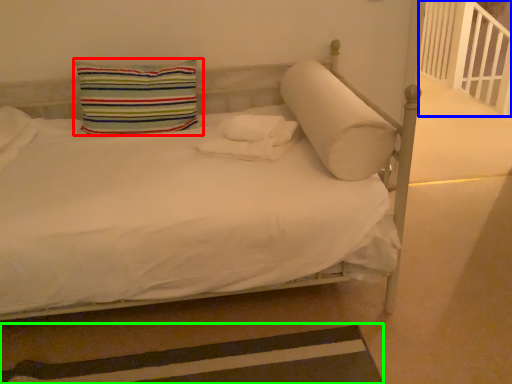
Question: Based on their relative distances, which object is nearer to pillow (highlighted by a red box)? Choose from balustrade (highlighted by a blue box) and strip (highlighted by a green box).

Choices:
 (A) balustrade
 (B) strip

Answer: (B)